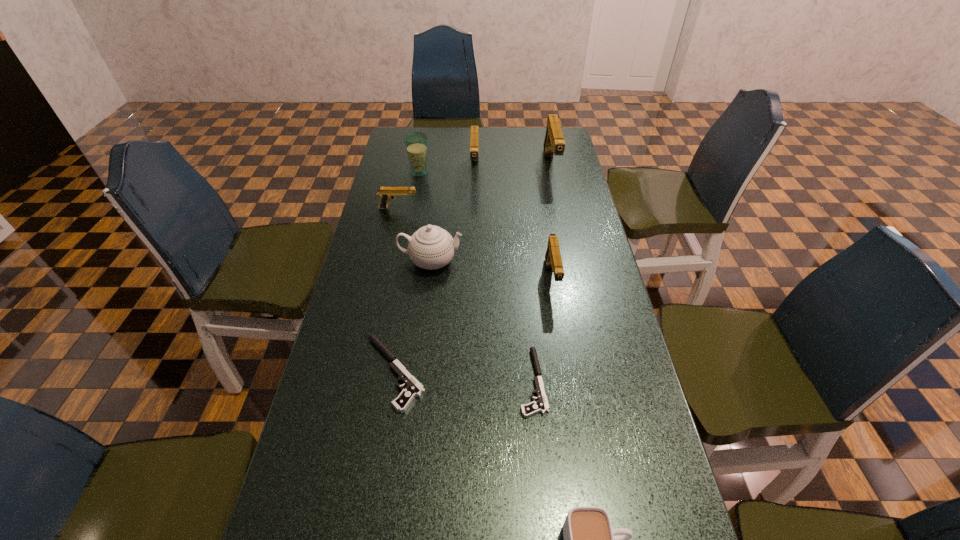
Image resolution: width=960 pixels, height=540 pixels. In order to click on the left black pistol in this screenshot , I will do `click(413, 389)`.

I want to click on the bigger black pistol, so click(413, 389).

At what (x,y) coordinates should I click in order to perform the action: click on the shortest object. Please return your answer as a coordinate pair (x, y). Looking at the image, I should click on (541, 405).

What are the coordinates of `the fourth pistol from left to right` in the screenshot? It's located at (541, 405).

At what (x,y) coordinates should I click in order to perform the action: click on free point located at the barrel of the rightmost tan pistol. Please return your answer as a coordinate pair (x, y). Looking at the image, I should click on (558, 198).

At what (x,y) coordinates should I click in order to perform the action: click on free space located on the front of the glass. Please return your answer as a coordinate pair (x, y). Looking at the image, I should click on (408, 236).

You are a GUI agent. You are given a task and a screenshot of the screen. Output one action in this format:
    pyautogui.click(x=<x>, y=<y>)
    Task: Click on the free space located at the barrel of the second tan pistol from left to right
    The height and width of the screenshot is (540, 960).
    Given the screenshot: What is the action you would take?
    pyautogui.click(x=474, y=214)

Locate an element on the screen. The image size is (960, 540). vacant space located 0.360m on the spout of the chinaware is located at coordinates (582, 261).

Find the location of a particular element. blank space located at the barrel of the second tan pistol from right to left is located at coordinates (568, 382).

Image resolution: width=960 pixels, height=540 pixels. What are the coordinates of `free point located at the barrel of the sixth nearest object` in the screenshot? It's located at (435, 208).